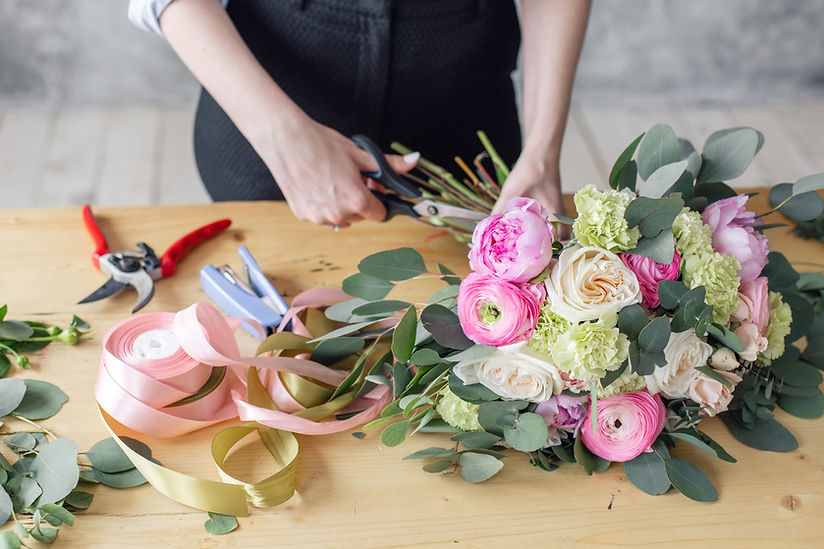
This screenshot has height=549, width=824. I want to click on table, so click(x=307, y=248).